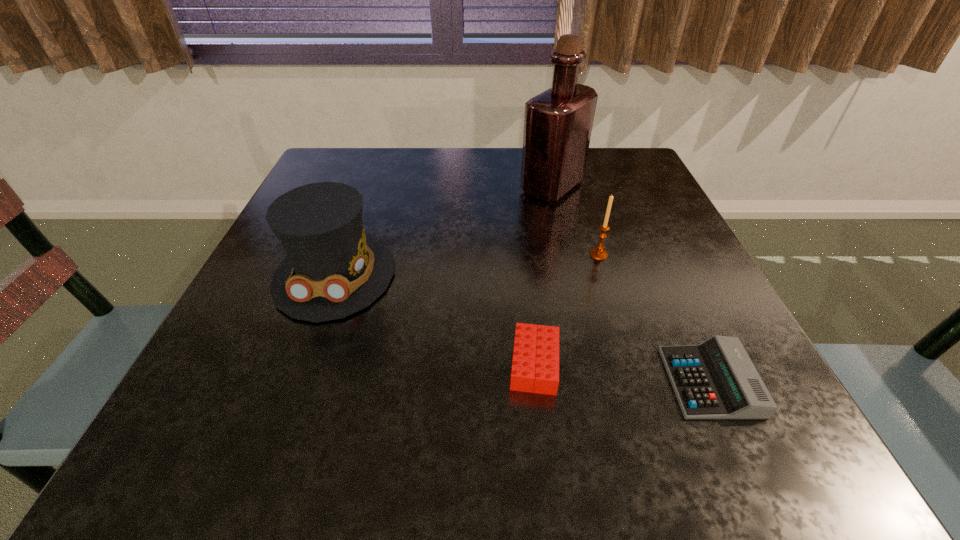
In the image, there is a desktop. Where is `vacant space at the far left corner`? The width and height of the screenshot is (960, 540). vacant space at the far left corner is located at coordinates (335, 169).

At what (x,y) coordinates should I click in order to perform the action: click on blank space at the near left corner of the desktop. Please return your answer as a coordinate pair (x, y). Looking at the image, I should click on (198, 429).

I want to click on free space at the far right corner of the desktop, so click(x=635, y=187).

In the image, there is a desktop. Where is `blank space at the near right corner`? The width and height of the screenshot is (960, 540). blank space at the near right corner is located at coordinates (793, 423).

Where is `vacant space in between the farthest object and the candle_holder`? vacant space in between the farthest object and the candle_holder is located at coordinates (575, 221).

In order to click on empty space that is in between the dress hat and the farthest object in this screenshot , I will do [444, 231].

Locate an element on the screen. empty space that is in between the farthest object and the candle_holder is located at coordinates (575, 221).

Locate an element on the screen. free spot between the Lego and the candle_holder is located at coordinates (566, 309).

Where is `vacant region between the rightmost object and the candle_holder`? vacant region between the rightmost object and the candle_holder is located at coordinates click(654, 319).

I want to click on free area in between the candle_holder and the leftmost object, so click(x=467, y=265).